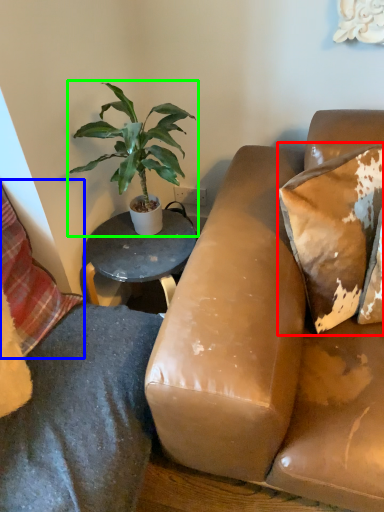
Question: Estimate the real-world distances between objects in this image. Which object is closer to pillow (highlighted by a red box), pillow (highlighted by a blue box) or houseplant (highlighted by a green box)?

Choices:
 (A) pillow
 (B) houseplant

Answer: (B)